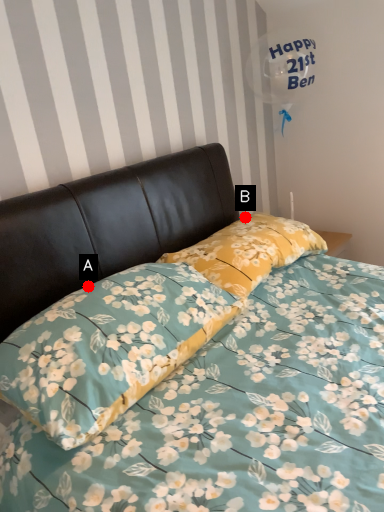
Question: Two points are circled on the image, labeled by A and B beside each circle. Which point is closer to the camera?

Choices:
 (A) A is closer
 (B) B is closer

Answer: (A)